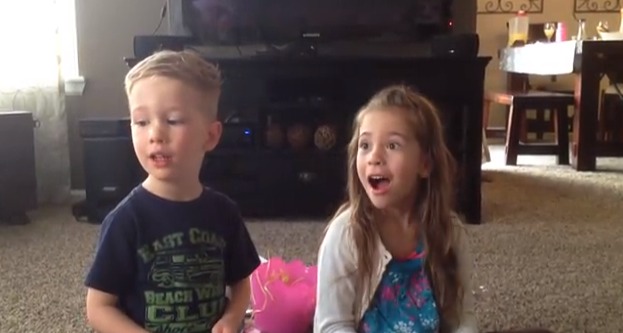
Image resolution: width=623 pixels, height=333 pixels. In order to click on table in this screenshot , I will do `click(592, 39)`.